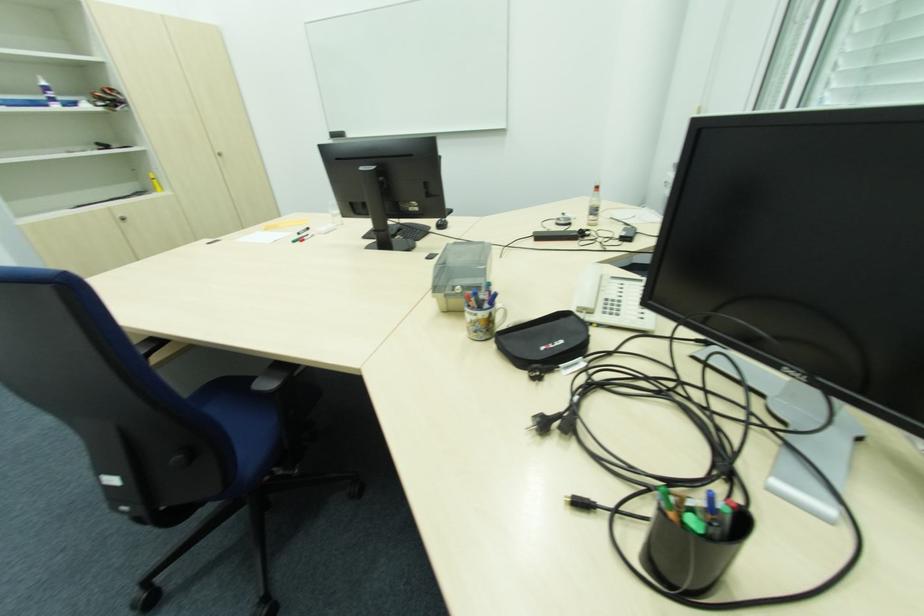
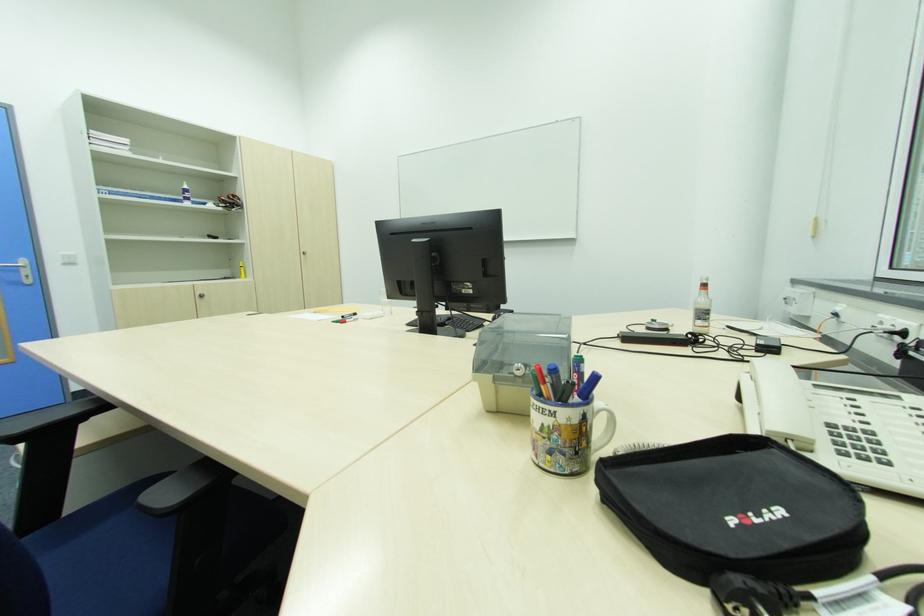
Locate, in the second image, the point that corresponds to point 565,342 in the first image.

(783, 513)